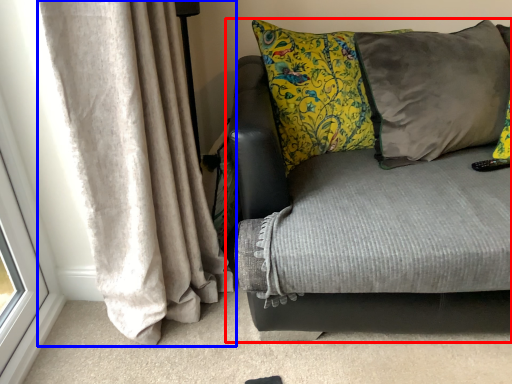
Question: Which point is further to the camera, studio couch (highlighted by a red box) or curtain (highlighted by a blue box)?

Choices:
 (A) studio couch
 (B) curtain

Answer: (A)